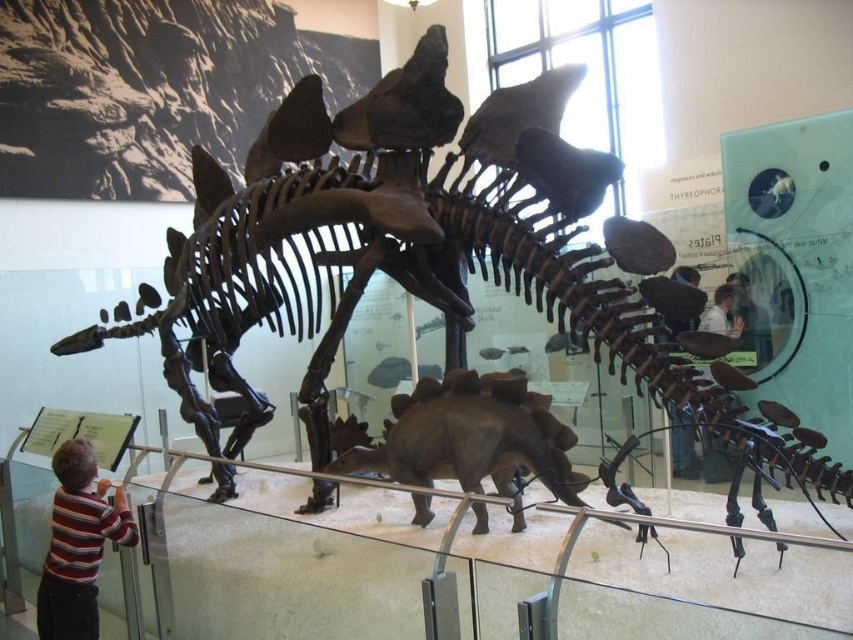
You are a museum visitor standing near the striped shirt at lower left and want to take a photo of the brown matte stegosaurus at center without any obstructions. Considering the distance between them, is it possible to capture the entire stegosaurus in your photo without moving closer?

The brown matte stegosaurus at center is 1.31 meters from the striped shirt at lower left. Since the distance is relatively close, it should be possible to capture the entire stegosaurus in the photo without moving closer, provided your camera has a wide enough lens to accommodate the stegosaurus size at that distance.

You are a museum visitor standing near the exhibit. You want to take a photo of the brown matte stegosaurus at center without the striped shirt at lower left appearing in the frame. Is it possible to do so by adjusting your position?

The brown matte stegosaurus at center is much larger than the striped shirt at lower left. Since the shirt is smaller and positioned at the lower left, you can move to the right or left to frame the stegosaurus while excluding the shirt from the shot.

Where is the brown matte stegosaurus at center located in the image?

The brown matte stegosaurus at center is located at point coordinates of (x=473, y=438).